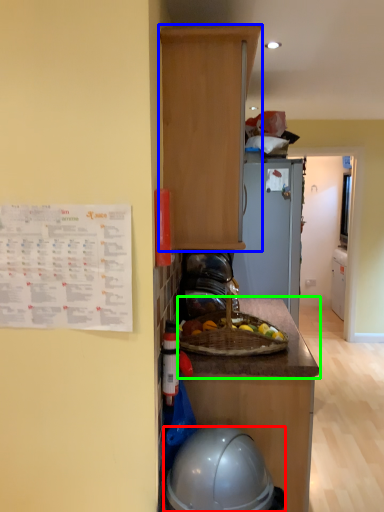
Question: Based on their relative distances, which object is nearer to helmet (highlighted by a red box)? Choose from cabinetry (highlighted by a blue box) and countertop (highlighted by a green box).

Choices:
 (A) cabinetry
 (B) countertop

Answer: (B)